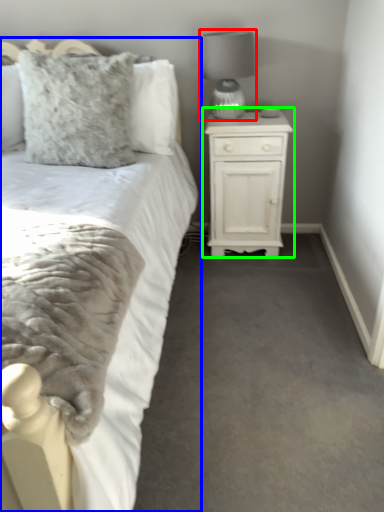
Question: Considering the real-world distances, which object is closest to lamp (highlighted by a red box)? bed (highlighted by a blue box) or nightstand (highlighted by a green box).

Choices:
 (A) bed
 (B) nightstand

Answer: (B)